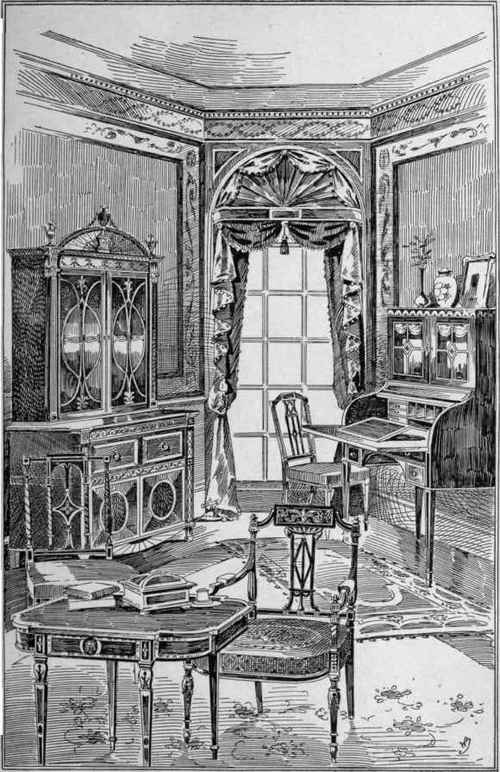
You are a GUI agent. You are given a task and a screenshot of the screen. Output one action in this format:
    pyautogui.click(x=<x>, y=<y>)
    Task: Click on the left drawer
    The height and width of the screenshot is (772, 500).
    Given the screenshot: What is the action you would take?
    pyautogui.click(x=118, y=455)